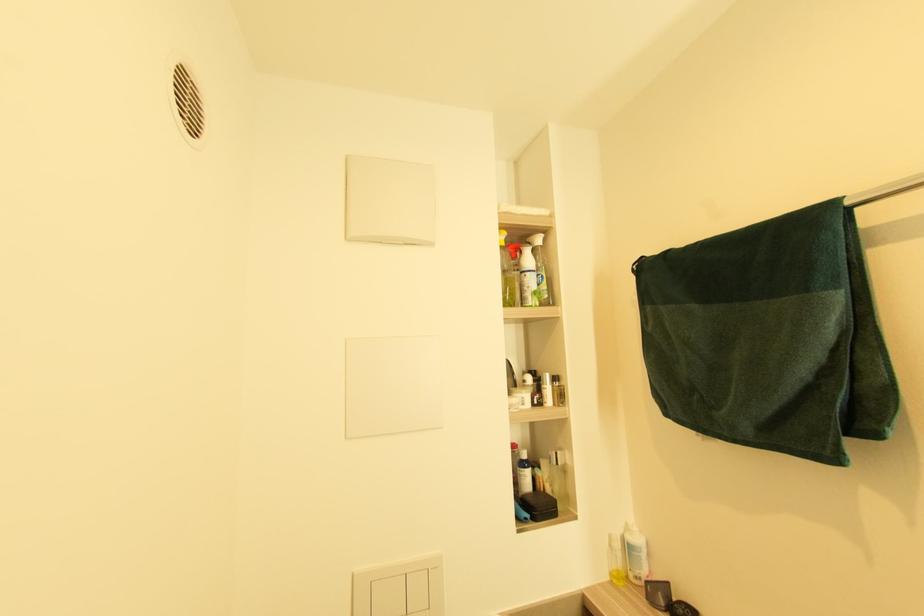
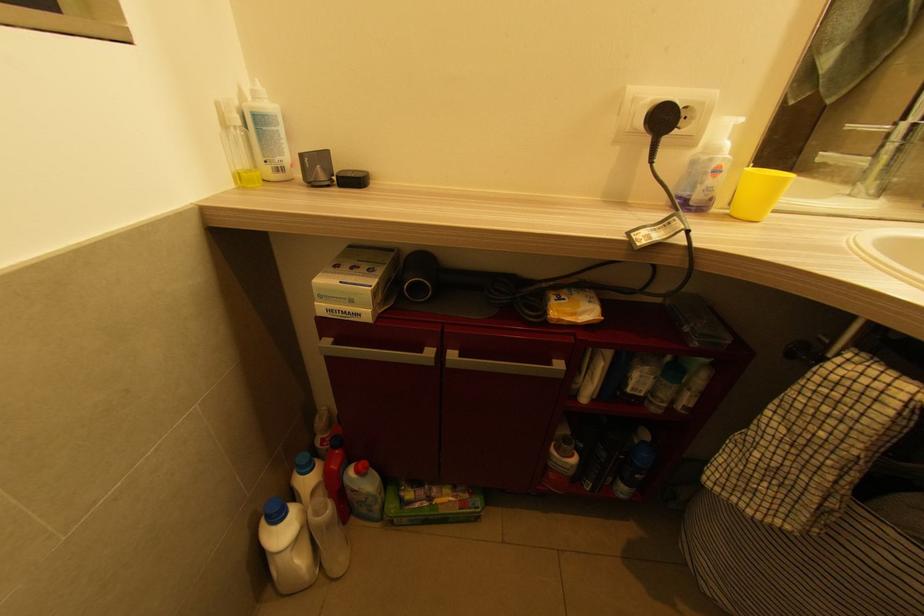
First-person continuous shooting, in which direction is the camera rotating?

The camera's rotation is toward right-down.